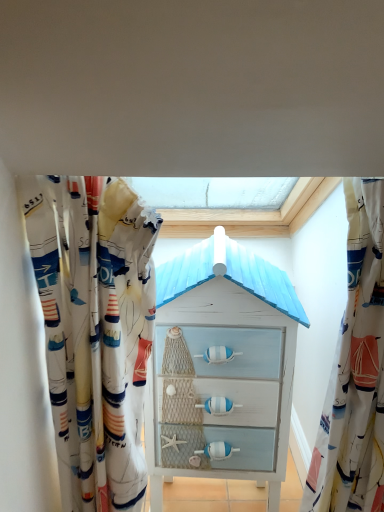
Question: Is white painted wood chest of drawers at center beside white fabric curtain at right, arranged as the 1th curtain when viewed from the right?

Choices:
 (A) no
 (B) yes

Answer: (A)

Question: Can you confirm if white painted wood chest of drawers at center is shorter than white fabric curtain at right, the 2th curtain from the left?

Choices:
 (A) no
 (B) yes

Answer: (A)

Question: From the image's perspective, is white painted wood chest of drawers at center under white fabric curtain at right, arranged as the 1th curtain when viewed from the right?

Choices:
 (A) yes
 (B) no

Answer: (A)

Question: Is there a large distance between white painted wood chest of drawers at center and white fabric curtain at right, the 2th curtain from the left?

Choices:
 (A) yes
 (B) no

Answer: (B)

Question: Does white painted wood chest of drawers at center have a smaller size compared to white fabric curtain at right, arranged as the 1th curtain when viewed from the right?

Choices:
 (A) yes
 (B) no

Answer: (B)

Question: Considering the relative sizes of white painted wood chest of drawers at center and white fabric curtain at right, the 2th curtain from the left, in the image provided, is white painted wood chest of drawers at center thinner than white fabric curtain at right, the 2th curtain from the left,?

Choices:
 (A) no
 (B) yes

Answer: (A)

Question: Is white fabric curtain at left, the 2th curtain from the right, located within white fabric curtain at right, arranged as the 1th curtain when viewed from the right?

Choices:
 (A) yes
 (B) no

Answer: (B)

Question: Is white fabric curtain at right, arranged as the 1th curtain when viewed from the right, aimed at white fabric curtain at left, the first curtain from the left?

Choices:
 (A) yes
 (B) no

Answer: (B)

Question: Is white fabric curtain at right, the 2th curtain from the left, positioned behind white fabric curtain at left, the 2th curtain from the right?

Choices:
 (A) no
 (B) yes

Answer: (B)

Question: Does white fabric curtain at right, arranged as the 1th curtain when viewed from the right, have a larger size compared to white fabric curtain at left, the first curtain from the left?

Choices:
 (A) yes
 (B) no

Answer: (B)

Question: Does white fabric curtain at right, arranged as the 1th curtain when viewed from the right, have a lesser height compared to white fabric curtain at left, the first curtain from the left?

Choices:
 (A) yes
 (B) no

Answer: (A)

Question: Is white fabric curtain at right, the 2th curtain from the left, touching white fabric curtain at left, the first curtain from the left?

Choices:
 (A) no
 (B) yes

Answer: (A)

Question: Can you confirm if white fabric curtain at right, the 2th curtain from the left, is shorter than white painted wood chest of drawers at center?

Choices:
 (A) no
 (B) yes

Answer: (B)